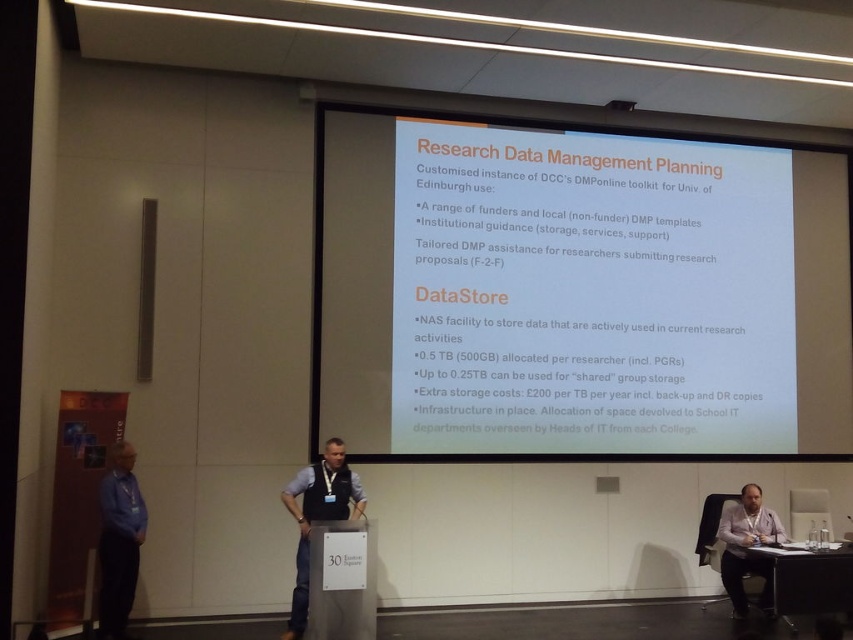
Question: Estimate the real-world distances between objects in this image. Which object is closer to the black plastic table at lower right?

Choices:
 (A) white paper at center
 (B) pink fabric shirt at lower right
 (C) dark gray shirt at center

Answer: (B)

Question: Is blue fabric shirt at lower left thinner than pink fabric shirt at lower right?

Choices:
 (A) no
 (B) yes

Answer: (B)

Question: Is white paper at center to the left of blue fabric shirt at lower left from the viewer's perspective?

Choices:
 (A) yes
 (B) no

Answer: (B)

Question: Among these points, which one is nearest to the camera?

Choices:
 (A) (711, 396)
 (B) (718, 532)

Answer: (B)

Question: Is white paper at center closer to camera compared to black plastic table at lower right?

Choices:
 (A) no
 (B) yes

Answer: (A)

Question: Which of the following is the closest to the observer?

Choices:
 (A) white paper at center
 (B) pink fabric shirt at lower right

Answer: (B)